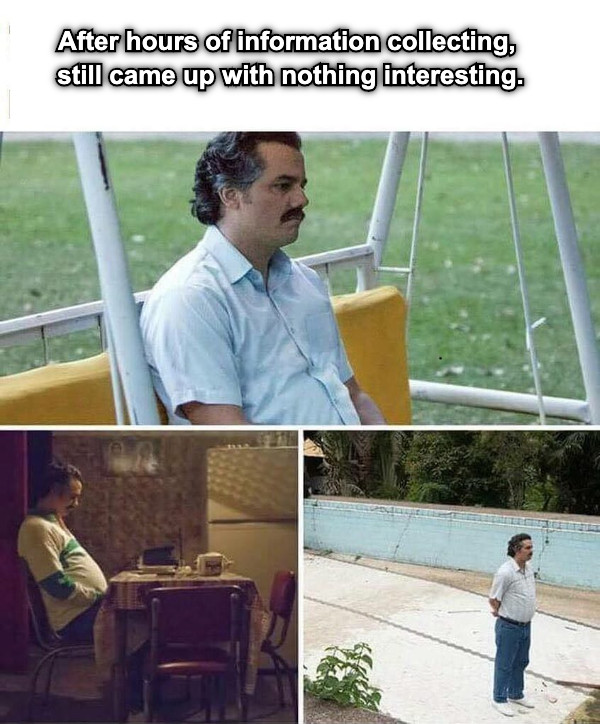
You are a GUI agent. You are given a task and a screenshot of the screen. Output one action in this format:
    pyautogui.click(x=<x>, y=<y>)
    Task: Click on the tablecloth
    
    Given the screenshot: What is the action you would take?
    pyautogui.click(x=137, y=585)